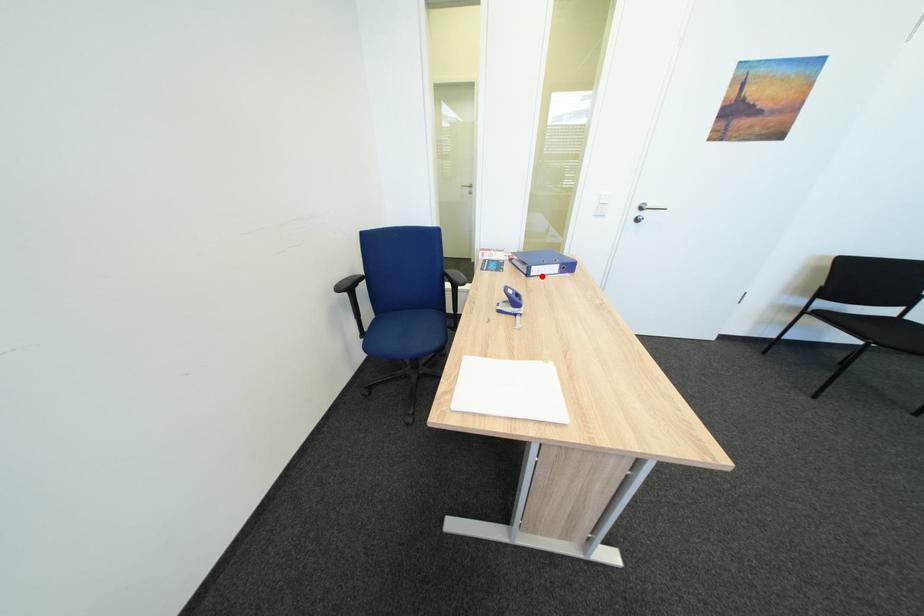
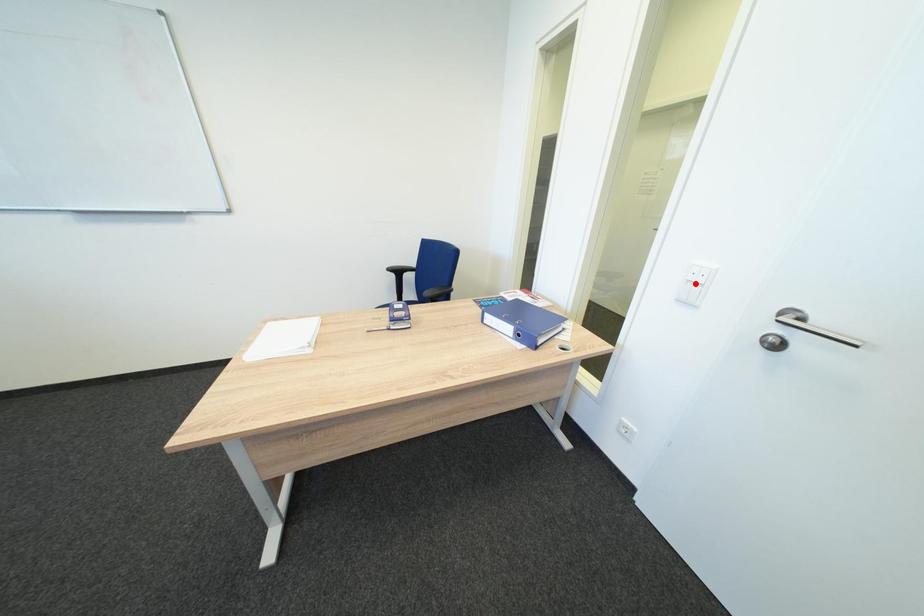
Looking at this image, I am providing you with two images of the same scene from different viewpoints. A red point is marked on the first image and another point is marked on the second image. Is the marked point in image1 the same physical position as the marked point in image2?

No